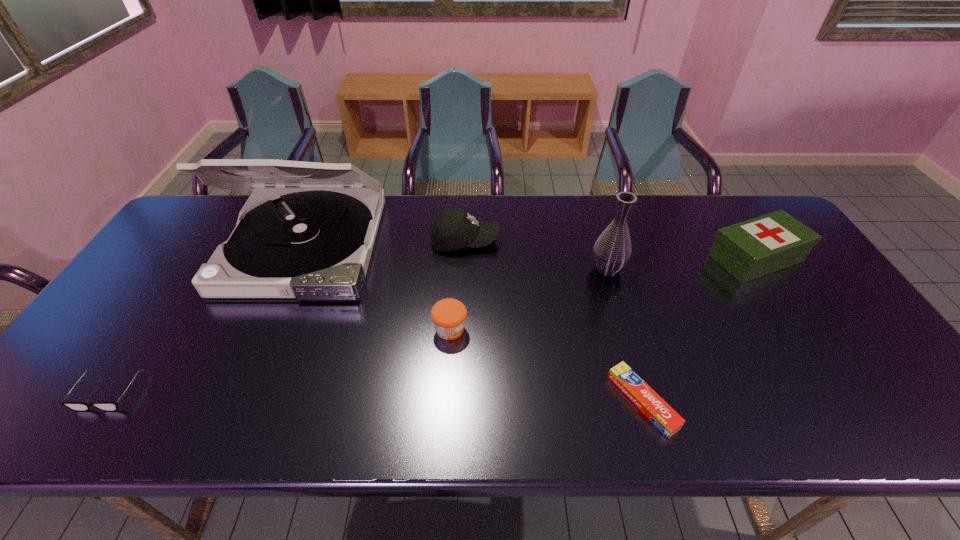
Image resolution: width=960 pixels, height=540 pixels. I want to click on blank area in the image that satisfies the following two spatial constraints: 1. on the control panel of the vase; 2. on the left side of the sixth object from right to left, so click(294, 269).

Image resolution: width=960 pixels, height=540 pixels. What are the coordinates of `free space in the image that satisfies the following two spatial constraints: 1. on the back side of the toothpaste; 2. on the front label of the fifth farthest object` in the screenshot? It's located at (622, 329).

Locate an element on the screen. free location that satisfies the following two spatial constraints: 1. on the front-facing side of the baseball cap; 2. on the right side of the vase is located at coordinates (464, 269).

At what (x,y) coordinates should I click in order to perform the action: click on free point that satisfies the following two spatial constraints: 1. on the front label of the toothpaste; 2. on the right side of the third nearest object. Please return your answer as a coordinate pair (x, y). The height and width of the screenshot is (540, 960). Looking at the image, I should click on (445, 401).

Find the location of a particular element. free space that satisfies the following two spatial constraints: 1. on the front-facing side of the toothpaste; 2. on the right side of the baseball cap is located at coordinates (459, 401).